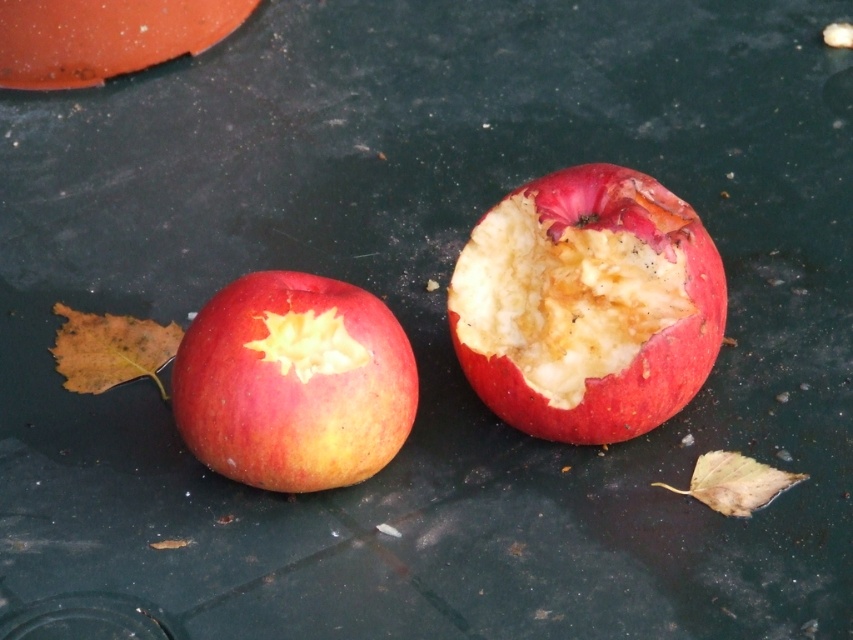
Question: Which point appears farthest from the camera in this image?

Choices:
 (A) pos(575,364)
 (B) pos(251,397)

Answer: (A)

Question: Does red matte apple at center have a smaller size compared to shiny red apple at center?

Choices:
 (A) no
 (B) yes

Answer: (A)

Question: Can you confirm if red matte apple at center is positioned below shiny red apple at center?

Choices:
 (A) yes
 (B) no

Answer: (B)

Question: Does red matte apple at center have a smaller size compared to shiny red apple at center?

Choices:
 (A) yes
 (B) no

Answer: (B)

Question: Which object appears closest to the camera in this image?

Choices:
 (A) red matte apple at center
 (B) shiny red apple at center

Answer: (B)